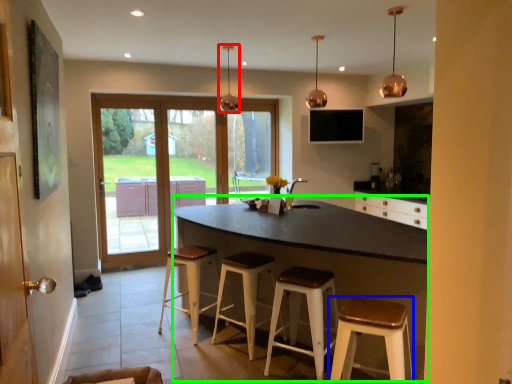
Question: Which is nearer to the light fixture (highlighted by a red box)? stool (highlighted by a blue box) or table (highlighted by a green box).

Choices:
 (A) stool
 (B) table

Answer: (B)